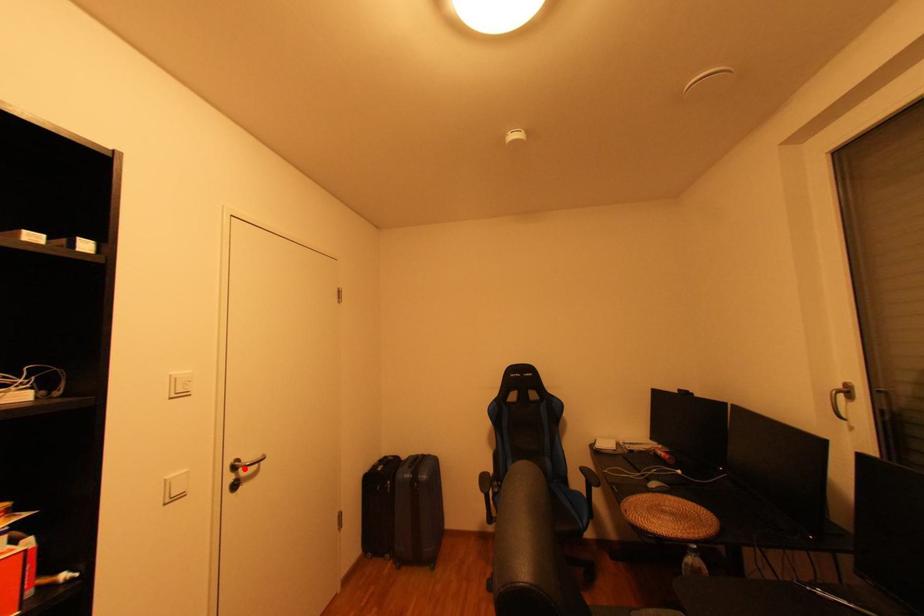
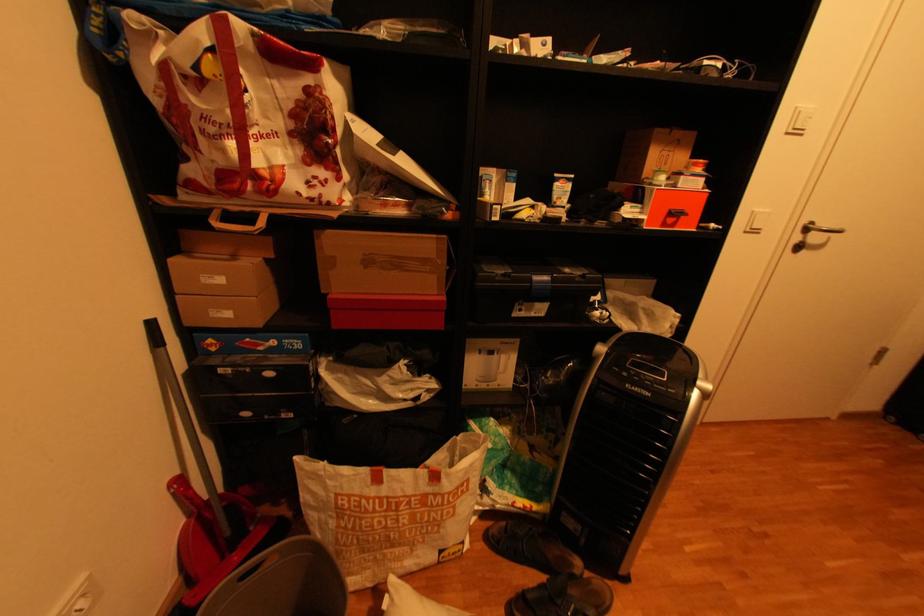
Locate, in the second image, the point that corresponds to the highlighted location in the first image.

(816, 230)